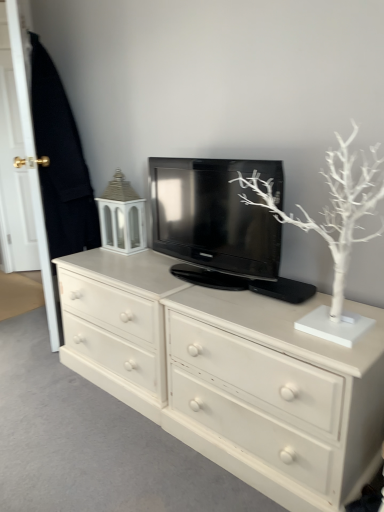
Question: Should I look upward or downward to see black glossy television at center?

Choices:
 (A) down
 (B) up

Answer: (B)

Question: Does black glossy television at center appear on the right side of white matte tree at upper right?

Choices:
 (A) yes
 (B) no

Answer: (B)

Question: From the image's perspective, is black glossy television at center over white matte tree at upper right?

Choices:
 (A) yes
 (B) no

Answer: (A)

Question: Is the position of black glossy television at center more distant than that of white matte tree at upper right?

Choices:
 (A) no
 (B) yes

Answer: (B)

Question: Is black glossy television at center shorter than white matte tree at upper right?

Choices:
 (A) yes
 (B) no

Answer: (A)

Question: Is black glossy television at center wider than white matte tree at upper right?

Choices:
 (A) no
 (B) yes

Answer: (A)

Question: Considering the relative positions of black glossy television at center and white matte tree at upper right in the image provided, is black glossy television at center to the left of white matte tree at upper right from the viewer's perspective?

Choices:
 (A) no
 (B) yes

Answer: (B)

Question: Is there a large distance between white matte tree at upper right and white painted wood chest of drawers at center?

Choices:
 (A) yes
 (B) no

Answer: (B)

Question: Is white matte tree at upper right at the right side of white painted wood chest of drawers at center?

Choices:
 (A) yes
 (B) no

Answer: (A)

Question: Does white matte tree at upper right have a lesser height compared to white painted wood chest of drawers at center?

Choices:
 (A) no
 (B) yes

Answer: (A)

Question: Does white matte tree at upper right have a greater height compared to white painted wood chest of drawers at center?

Choices:
 (A) no
 (B) yes

Answer: (B)

Question: Can you confirm if white matte tree at upper right is thinner than white painted wood chest of drawers at center?

Choices:
 (A) yes
 (B) no

Answer: (A)

Question: Is white matte tree at upper right facing away from white painted wood chest of drawers at center?

Choices:
 (A) yes
 (B) no

Answer: (B)

Question: From a real-world perspective, is black glossy television at center located beneath white wood door at left?

Choices:
 (A) yes
 (B) no

Answer: (A)